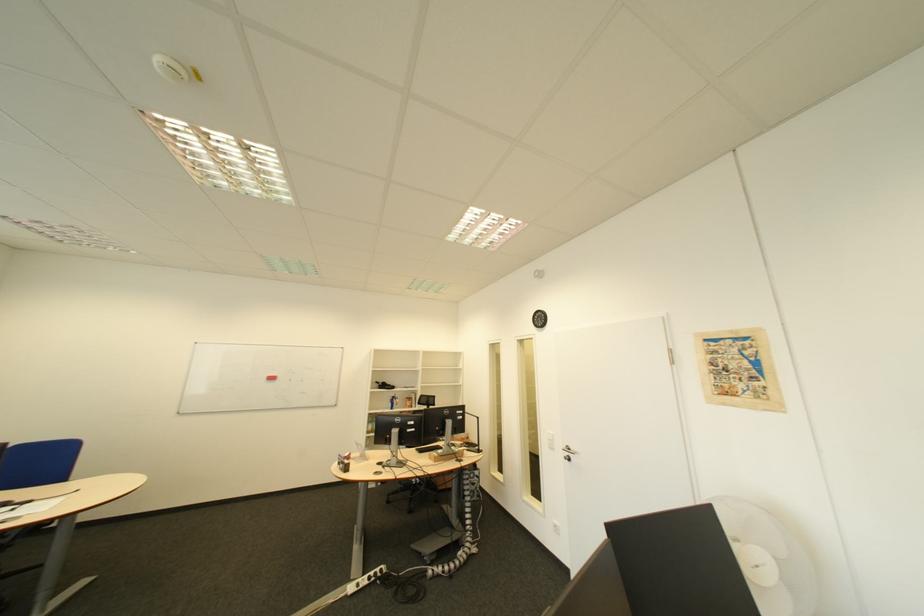
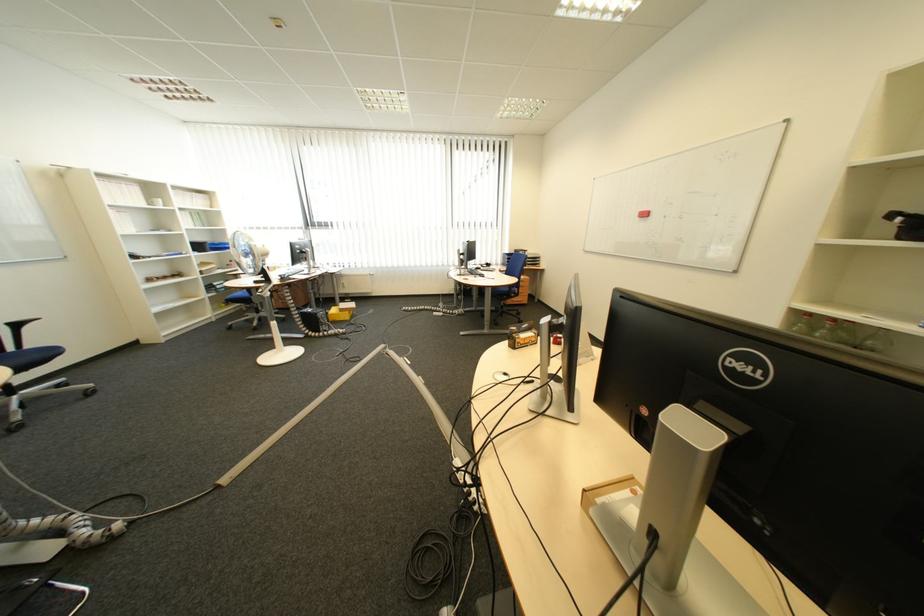
Question: I am providing you with two images of the same scene from different viewpoints. Please identify which objects are invisible in image2.

Choices:
 (A) blue chair sitting surface
 (B) glass bottle
 (C) black headrest pillow
 (D) red board eraser

Answer: (A)